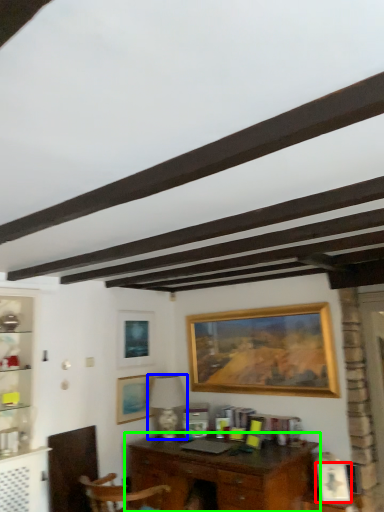
Question: Which is nearer to the picture frame (highlighted by a red box)? lamp (highlighted by a blue box) or desk (highlighted by a green box).

Choices:
 (A) lamp
 (B) desk

Answer: (B)